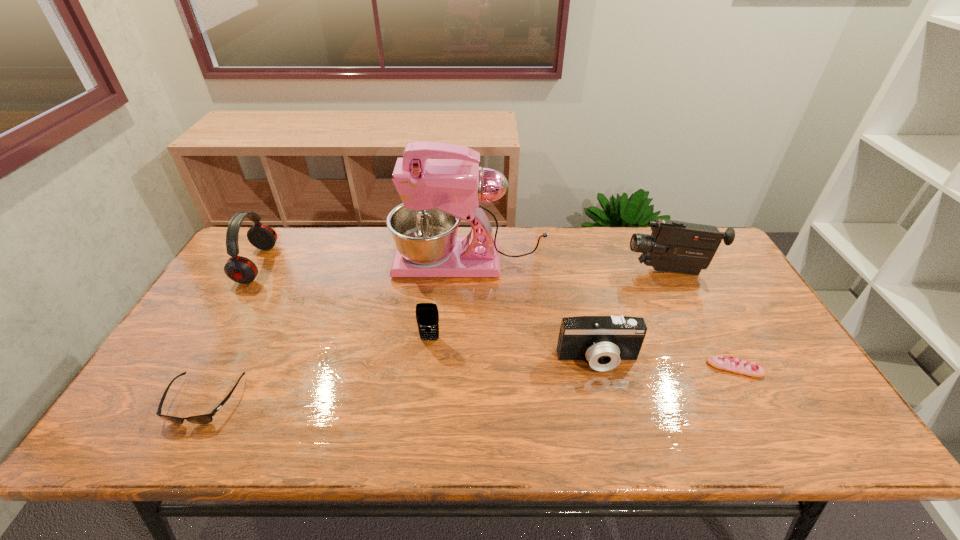
Identify the location of vacant space at the far edge. (555, 270).

In the image, there is a desktop. Identify the location of vacant space at the near edge. (699, 420).

Where is `vacant space at the left edge of the desktop`? Image resolution: width=960 pixels, height=540 pixels. vacant space at the left edge of the desktop is located at coordinates (220, 290).

Identify the location of vacant space at the right edge. (795, 396).

You are a GUI agent. You are given a task and a screenshot of the screen. Output one action in this format:
    pyautogui.click(x=<x>, y=<y>)
    Task: Click on the vacant area that lies between the eclair and the left camcorder
    
    Given the screenshot: What is the action you would take?
    pyautogui.click(x=666, y=364)

Where is `vacant point located between the shortest object and the nearer camcorder`? vacant point located between the shortest object and the nearer camcorder is located at coordinates 666,364.

Identify the location of blank region between the right camcorder and the cellular telephone. This screenshot has height=540, width=960. (550, 305).

Locate an element on the screen. This screenshot has height=540, width=960. vacant area that lies between the right camcorder and the nearer camcorder is located at coordinates (634, 315).

This screenshot has height=540, width=960. What are the coordinates of `unoccupied area between the tallest object and the farther camcorder` in the screenshot? It's located at (569, 267).

At what (x,y) coordinates should I click in order to perform the action: click on vacant area that lies between the fourth nearest object and the taller camcorder. Please return your answer as a coordinate pair (x, y). The height and width of the screenshot is (540, 960). Looking at the image, I should click on (550, 305).